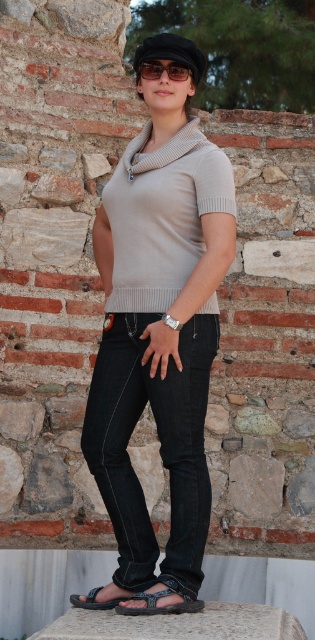
You are a photographer setting up a shoot. You want to ensure that both the matte beige sweater at center and the black textured sandal at lower center are clearly visible in the photo. Given their current positions, which object might partially obscure the other, and how can you adjust the composition to avoid this?

The black textured sandal at lower center is currently behind the matte beige sweater at center, so it might be partially obscured. To ensure both are visible, adjust the composition by moving the sandal forward or repositioning the sweater to create space between them.

From the picture: You are standing at the camera position and want to throw a small ball to the point marked as point (172,67). What is the minimum distance you need to throw the ball to reach that point?

The minimum distance you need to throw the ball to reach point (172,67) is 4.07 meters.

You are a fashion designer observing the person in the image. You need to determine which item is larger between the black matte sunglasses at center and the black leather sandal at lower center. Which one should you choose?

The black matte sunglasses at center is bigger than the black leather sandal at lower center, so you should choose the black matte sunglasses at center as the larger item.